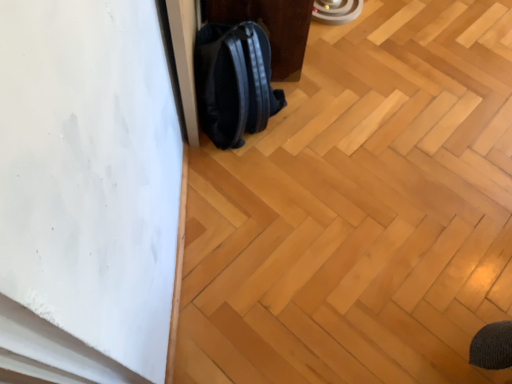
Question: Is black leather backpack at lower left to the right of black matte backpack at center from the viewer's perspective?

Choices:
 (A) no
 (B) yes

Answer: (B)

Question: Can you confirm if black leather backpack at lower left is taller than black matte backpack at center?

Choices:
 (A) no
 (B) yes

Answer: (A)

Question: Is black leather backpack at lower left positioned in front of black matte backpack at center?

Choices:
 (A) yes
 (B) no

Answer: (B)

Question: Can you confirm if black leather backpack at lower left is thinner than black matte backpack at center?

Choices:
 (A) yes
 (B) no

Answer: (B)

Question: Does black leather backpack at lower left have a smaller size compared to black matte backpack at center?

Choices:
 (A) no
 (B) yes

Answer: (A)

Question: Considering the positions of point (284, 4) and point (207, 104), is point (284, 4) closer or farther from the camera than point (207, 104)?

Choices:
 (A) closer
 (B) farther

Answer: (B)

Question: Is black leather backpack at lower left wider or thinner than black matte backpack at center?

Choices:
 (A) thin
 (B) wide

Answer: (B)

Question: Considering the positions of black leather backpack at lower left and black matte backpack at center in the image, is black leather backpack at lower left taller or shorter than black matte backpack at center?

Choices:
 (A) short
 (B) tall

Answer: (A)

Question: Considering the positions of black leather backpack at lower left and black matte backpack at center in the image, is black leather backpack at lower left bigger or smaller than black matte backpack at center?

Choices:
 (A) big
 (B) small

Answer: (A)

Question: From a real-world perspective, is black matte backpack at center above or below black leather backpack at lower left?

Choices:
 (A) above
 (B) below

Answer: (A)

Question: Relative to black leather backpack at lower left, is black matte backpack at center in front or behind?

Choices:
 (A) front
 (B) behind

Answer: (A)

Question: From the image's perspective, is black matte backpack at center above or below black leather backpack at lower left?

Choices:
 (A) above
 (B) below

Answer: (B)

Question: In terms of size, does black matte backpack at center appear bigger or smaller than black leather backpack at lower left?

Choices:
 (A) big
 (B) small

Answer: (B)

Question: From the image's perspective, is black leather backpack at lower left above or below natural wood floor at center?

Choices:
 (A) above
 (B) below

Answer: (A)

Question: Considering the positions of black leather backpack at lower left and natural wood floor at center in the image, is black leather backpack at lower left taller or shorter than natural wood floor at center?

Choices:
 (A) short
 (B) tall

Answer: (B)